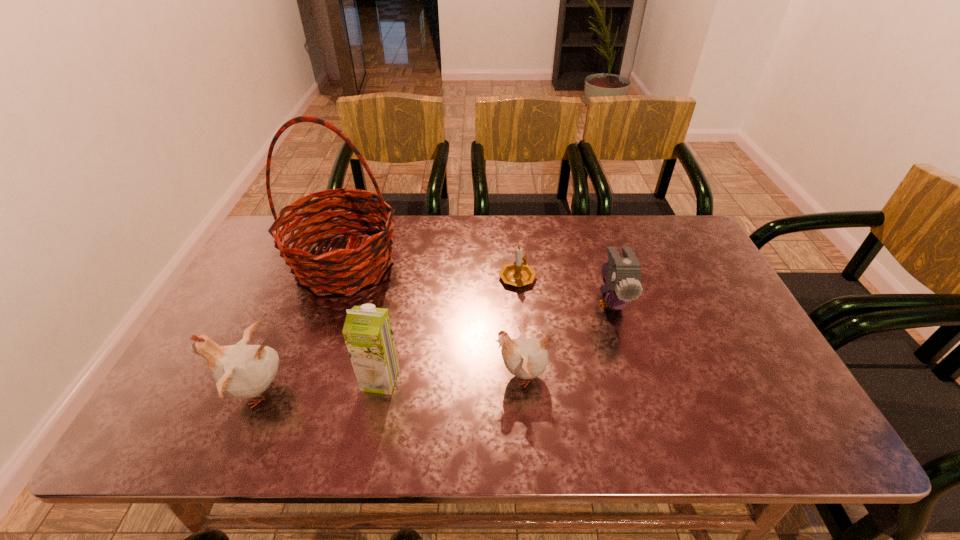
Where is `basket located in the left edge section of the desktop`? basket located in the left edge section of the desktop is located at coordinates (363, 263).

I want to click on object located in the far left corner section of the desktop, so (x=363, y=263).

Locate an element on the screen. object at the near left corner is located at coordinates (244, 371).

This screenshot has height=540, width=960. In order to click on free spot at the far edge of the desktop in this screenshot , I will do `click(636, 241)`.

This screenshot has height=540, width=960. I want to click on blank space at the left edge, so click(237, 335).

At what (x,y) coordinates should I click in order to perform the action: click on free space at the far right corner of the desktop. Please return your answer as a coordinate pair (x, y). Looking at the image, I should click on (660, 227).

Image resolution: width=960 pixels, height=540 pixels. Identify the location of vacant space at the near right corner of the desktop. (735, 407).

Where is `free spot between the second bird from right to left and the tallest object`? free spot between the second bird from right to left and the tallest object is located at coordinates (433, 319).

Locate an element on the screen. The height and width of the screenshot is (540, 960). vacant space that's between the shortest object and the tallest object is located at coordinates (431, 269).

What are the coordinates of `free space between the farthest bird and the second bird from right to left` in the screenshot? It's located at (566, 339).